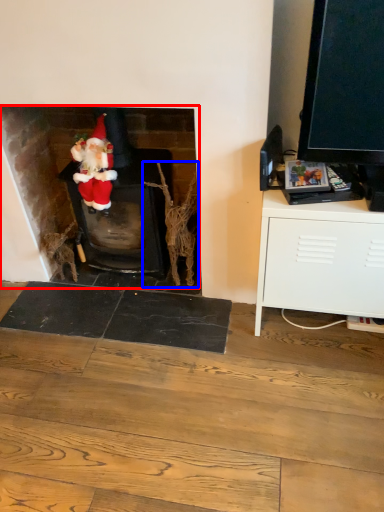
Question: Among these objects, which one is farthest to the camera, fireplace (highlighted by a red box) or branch (highlighted by a blue box)?

Choices:
 (A) fireplace
 (B) branch

Answer: (B)